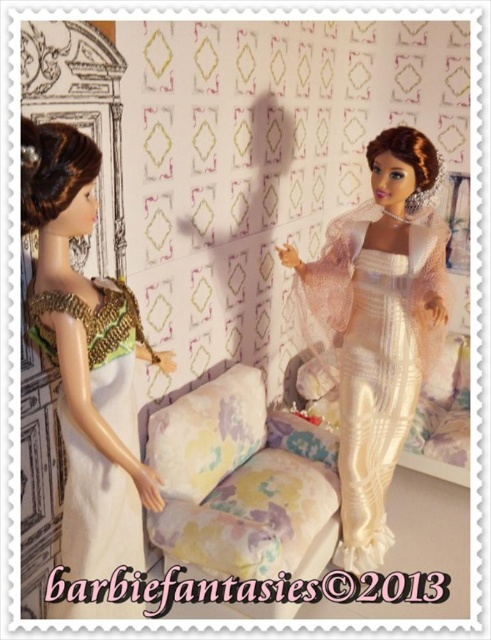
You are a tailor observing the miniature room scene. You need to determine which dress requires a longer hemline. Which dress between the ivory satin gown at center and the green and gold fabric dress at left should have a longer hemline?

The ivory satin gown at center is much taller than the green and gold fabric dress at left, so it should have a longer hemline to match its height.

Based on the photo, you are a fashion designer who needs to decide which dress to display in a narrow boutique window. Based on the scene, which dress between the ivory satin gown at center and the green and gold fabric dress at left would you choose to ensure it fits better in the limited space?

The ivory satin gown at center might be wider than the green and gold fabric dress at left, so the green and gold fabric dress at left would be a better choice for the narrow boutique window as it is likely narrower.

You are organizing a doll exhibition and need to determine which dress requires more display space. Based on the scene, which dress between the ivory satin gown at center and the green and gold fabric dress at left should be given a larger area?

The ivory satin gown at center requires more display space because it is bigger than the green and gold fabric dress at left.